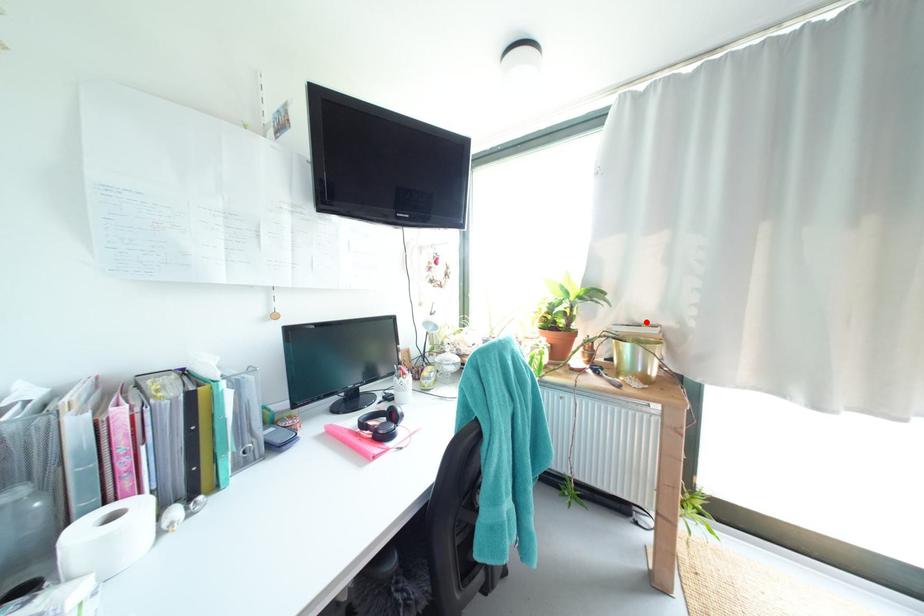
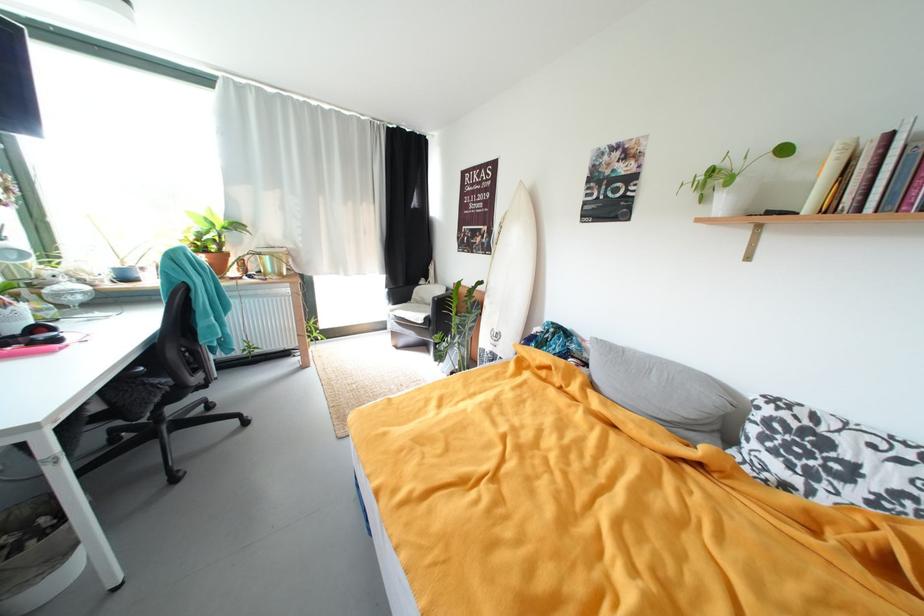
The point at the highlighted location is marked in the first image. Where is the corresponding point in the second image?

(281, 246)